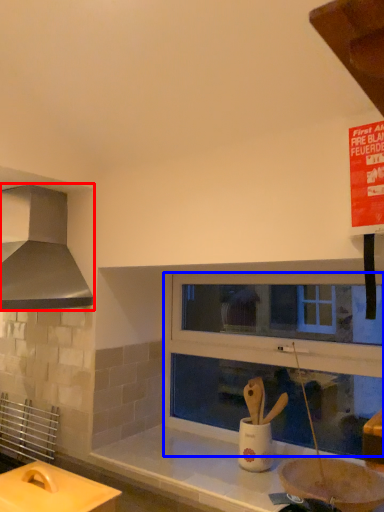
Question: Which of the following is the farthest to the observer, kitchen appliance (highlighted by a red box) or window frame (highlighted by a blue box)?

Choices:
 (A) kitchen appliance
 (B) window frame

Answer: (B)